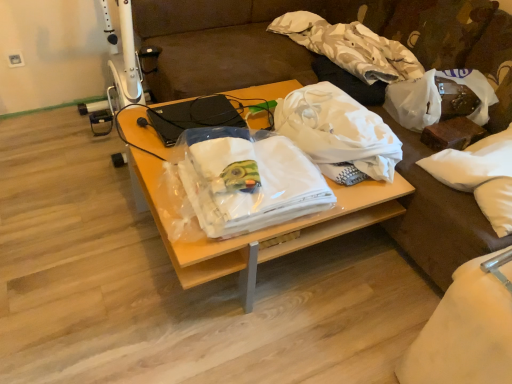
Question: Is white soft pillow at right taller or shorter than white plastic power outlet at upper left?

Choices:
 (A) short
 (B) tall

Answer: (B)

Question: From a real-world perspective, relative to white plastic power outlet at upper left, is white soft pillow at right vertically above or below?

Choices:
 (A) below
 (B) above

Answer: (B)

Question: Estimate the real-world distances between objects in this image. Which object is farther from the black matte laptop at center?

Choices:
 (A) white fabric at center, placed as the first cloth when sorted from front to back
 (B) white soft pillow at right
 (C) white fabric couch at center
 (D) white matte plastic bag at upper right, which is the 2th plastic bag from left to right
 (E) white plastic power outlet at upper left

Answer: (E)

Question: Considering the real-world distances, which object is farthest from the white plastic power outlet at upper left?

Choices:
 (A) white matte plastic bag at upper right, acting as the first plastic bag starting from the right
 (B) white fabric at center, the 2th cloth viewed from the top
 (C) black matte laptop at center
 (D) white soft pillow at right
 (E) white matte plastic bag at center, which appears as the 2th plastic bag when viewed from the right

Answer: (D)